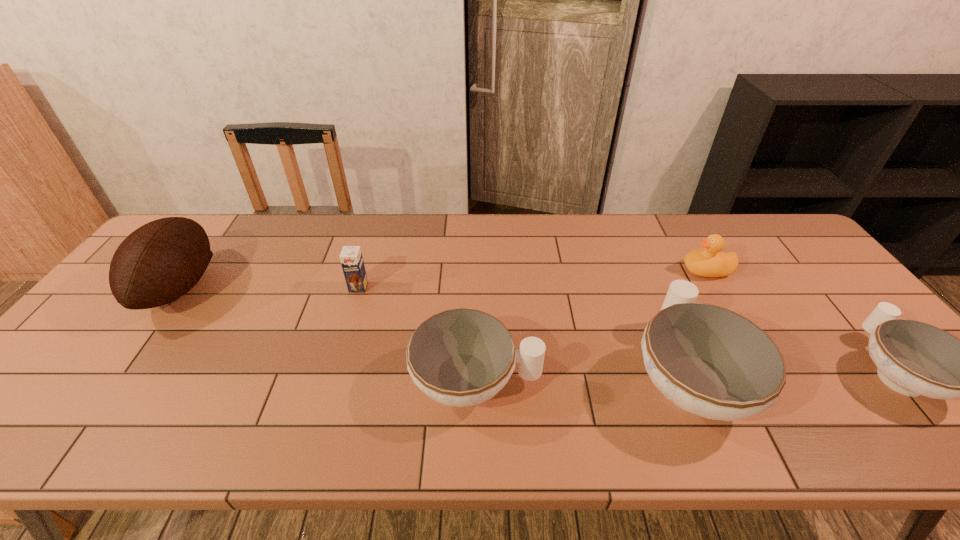
In the image, there is a desktop. Where is `free space at the right edge`? The image size is (960, 540). free space at the right edge is located at coordinates (784, 263).

In the image, there is a desktop. In order to click on vacant space at the far left corner in this screenshot , I will do `click(212, 229)`.

Where is `vacant space at the far right corner of the desktop`? Image resolution: width=960 pixels, height=540 pixels. vacant space at the far right corner of the desktop is located at coordinates (794, 250).

Locate an element on the screen. This screenshot has height=540, width=960. vacant space that's between the duck and the third object from left to right is located at coordinates (591, 326).

Locate which object is the third closest to the chocolate milk. Please provide its 2D coordinates. Your answer should be formatted as a tuple, i.e. [(x, y)], where the tuple contains the x and y coordinates of a point satisfying the conditions above.

[(710, 361)]

Image resolution: width=960 pixels, height=540 pixels. In order to click on object identified as the fourth closest to the fifth object from right to left in this screenshot , I will do `click(707, 262)`.

Identify which chinaware is the second nearest to the shortest object. Please provide its 2D coordinates. Your answer should be formatted as a tuple, i.e. [(x, y)], where the tuple contains the x and y coordinates of a point satisfying the conditions above.

[(462, 357)]

Identify which chinaware is the nearest to the second chinaware from right to left. Please provide its 2D coordinates. Your answer should be formatted as a tuple, i.e. [(x, y)], where the tuple contains the x and y coordinates of a point satisfying the conditions above.

[(462, 357)]

This screenshot has width=960, height=540. I want to click on vacant area that satisfies the following two spatial constraints: 1. on the face of the duck; 2. on the front label of the chocolate milk, so click(716, 287).